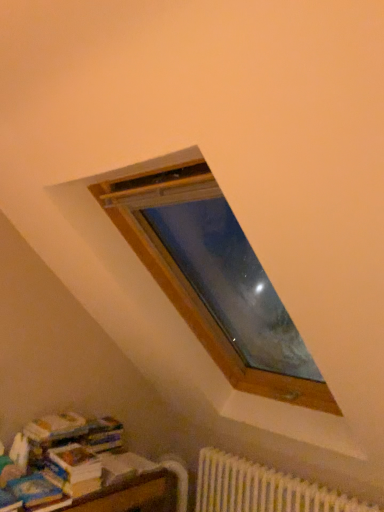
Question: From the image's perspective, is blue matte paperback book at lower left above or below white paper book at lower left?

Choices:
 (A) below
 (B) above

Answer: (A)

Question: Would you say blue matte paperback book at lower left is inside or outside white paper book at lower left?

Choices:
 (A) outside
 (B) inside

Answer: (A)

Question: Estimate the real-world distances between objects in this image. Which object is farther from the blue matte paperback book at lower left?

Choices:
 (A) white plastic radiator at lower right
 (B) white paper book at lower left

Answer: (A)

Question: Estimate the real-world distances between objects in this image. Which object is closer to the white plastic radiator at lower right?

Choices:
 (A) white paper book at lower left
 (B) blue matte paperback book at lower left

Answer: (A)